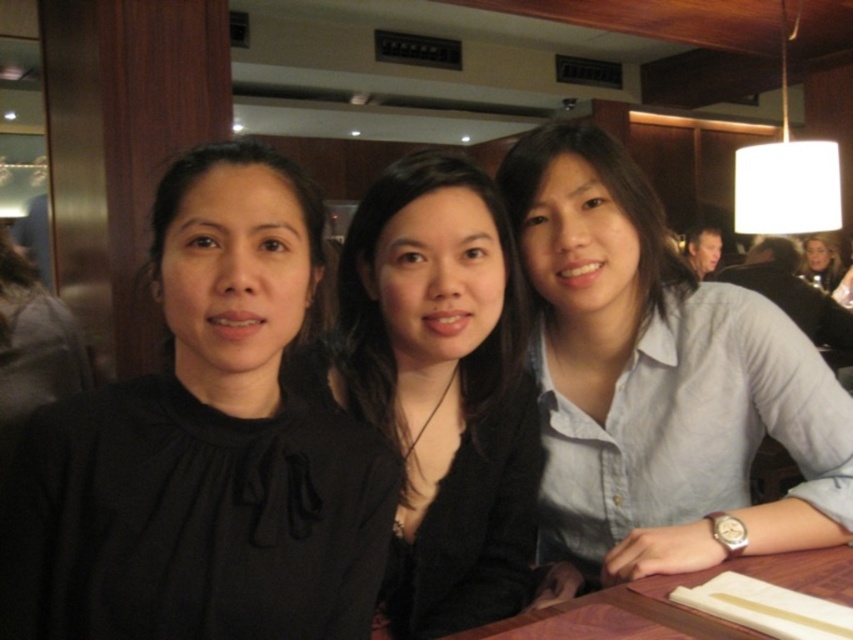
Between black matte shirt at center and light blue button-down shirt at right, which one is positioned higher?

light blue button-down shirt at right is above.

Is black matte shirt at center shorter than light blue button-down shirt at right?

Yes, black matte shirt at center is shorter than light blue button-down shirt at right.

The height and width of the screenshot is (640, 853). Describe the element at coordinates (204, 448) in the screenshot. I see `black matte shirt at center` at that location.

This screenshot has width=853, height=640. What are the coordinates of `black matte shirt at center` in the screenshot? It's located at (204, 448).

Who is shorter, black matte shirt at center or blonde hair at upper right?

blonde hair at upper right

How distant is black matte shirt at center from blonde hair at upper right?

black matte shirt at center and blonde hair at upper right are 14.37 feet apart from each other.

You are a GUI agent. You are given a task and a screenshot of the screen. Output one action in this format:
    pyautogui.click(x=<x>, y=<y>)
    Task: Click on the black matte shirt at center
    This screenshot has height=640, width=853.
    Given the screenshot: What is the action you would take?
    pyautogui.click(x=204, y=448)

Consider the image. Does black matte shirt at center appear on the right side of brown wooden table at lower right?

In fact, black matte shirt at center is to the left of brown wooden table at lower right.

Is point (277, 442) farther from camera compared to point (808, 561)?

No, it is not.

Which is in front, point (341, 528) or point (651, 611)?

Point (341, 528) is in front.

Where is `black matte shirt at center`? black matte shirt at center is located at coordinates (204, 448).